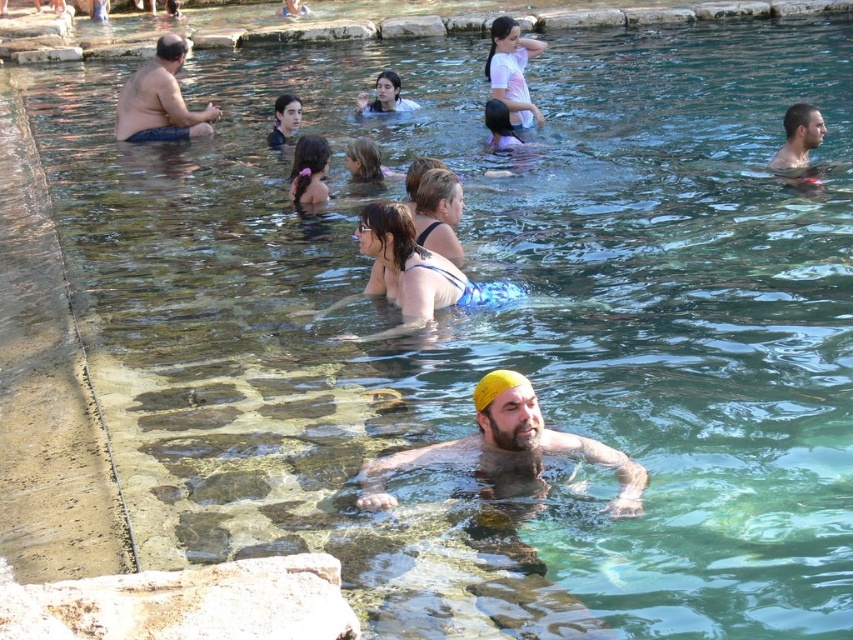
Does yellow rubber cap at center appear over matte skin man at left?

No.

From the picture: Between yellow rubber cap at center and matte skin man at left, which one has more height?

matte skin man at left is taller.

What do you see at coordinates (508, 442) in the screenshot? This screenshot has height=640, width=853. I see `yellow rubber cap at center` at bounding box center [508, 442].

Locate an element on the screen. The height and width of the screenshot is (640, 853). yellow rubber cap at center is located at coordinates (508, 442).

Who is more distant from viewer, (622,509) or (527,124)?

The point (527,124) is more distant.

Describe the element at coordinates (508, 442) in the screenshot. Image resolution: width=853 pixels, height=640 pixels. I see `yellow rubber cap at center` at that location.

Find the location of a particular element. yellow rubber cap at center is located at coordinates (508, 442).

How distant is white matte shirt at upper center from dark brown hair at center?

The distance of white matte shirt at upper center from dark brown hair at center is 9.47 meters.

The width and height of the screenshot is (853, 640). Describe the element at coordinates (512, 70) in the screenshot. I see `white matte shirt at upper center` at that location.

Where is `white matte shirt at upper center`? Image resolution: width=853 pixels, height=640 pixels. white matte shirt at upper center is located at coordinates (512, 70).